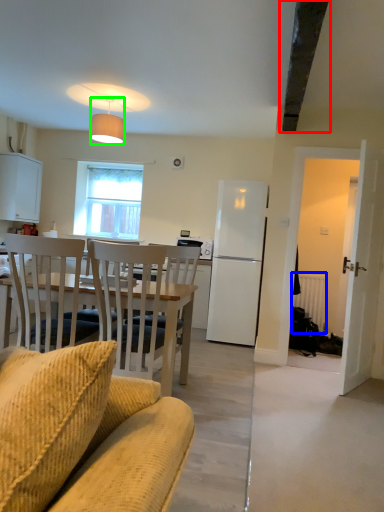
Question: Estimate the real-world distances between objects in this image. Which object is closer to exhaust hood (highlighted by a red box), radiator (highlighted by a blue box) or lamp (highlighted by a green box)?

Choices:
 (A) radiator
 (B) lamp

Answer: (B)